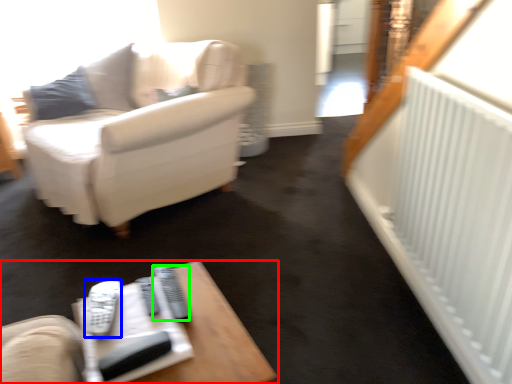
Question: Which object is the closest to the table (highlighted by a red box)? Choose among these: remote (highlighted by a blue box) or remote (highlighted by a green box).

Choices:
 (A) remote
 (B) remote

Answer: (B)